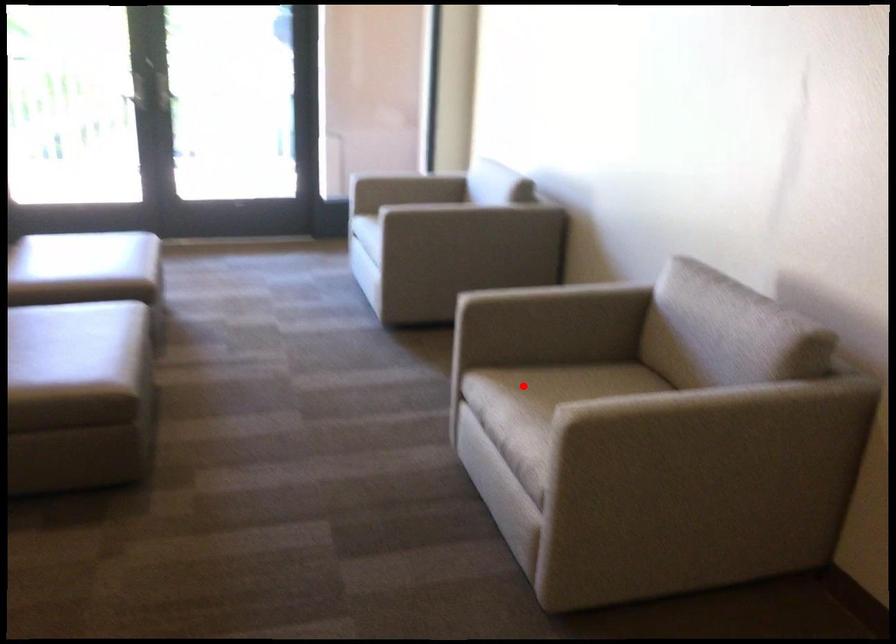
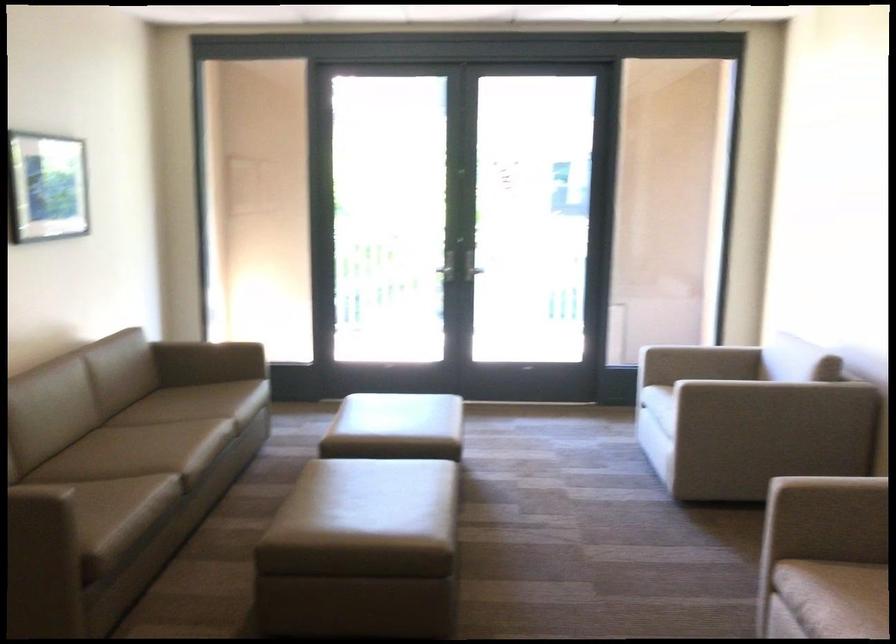
Find the pixel in the second image that matches the highlighted location in the first image.

(856, 591)